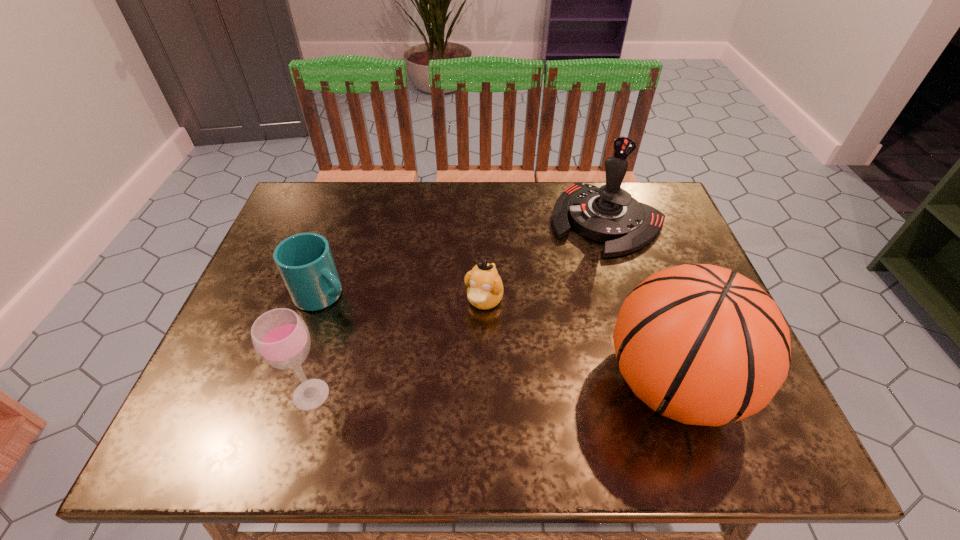
Identify the location of free spot between the basketball and the wineglass. (492, 389).

You are a GUI agent. You are given a task and a screenshot of the screen. Output one action in this format:
    pyautogui.click(x=<x>, y=<y>)
    Task: Click on the unoccupied area between the wineglass and the cup
    The height and width of the screenshot is (540, 960).
    Given the screenshot: What is the action you would take?
    pyautogui.click(x=317, y=344)

This screenshot has height=540, width=960. In order to click on unoccupied area between the wineglass and the cup in this screenshot , I will do `click(317, 344)`.

Find the location of a particular element. Image resolution: width=960 pixels, height=540 pixels. empty space that is in between the farthest object and the duckling is located at coordinates 545,260.

Find the location of a particular element. empty space between the wineglass and the joystick is located at coordinates (459, 307).

Locate an element on the screen. The width and height of the screenshot is (960, 540). free space between the third object from left to right and the basketball is located at coordinates (578, 342).

Identify which object is the nearest to the third object from right to left. Please provide its 2D coordinates. Your answer should be formatted as a tuple, i.e. [(x, y)], where the tuple contains the x and y coordinates of a point satisfying the conditions above.

[(609, 214)]

The height and width of the screenshot is (540, 960). In order to click on object that ranks as the fourth closest to the cup in this screenshot , I will do `click(702, 345)`.